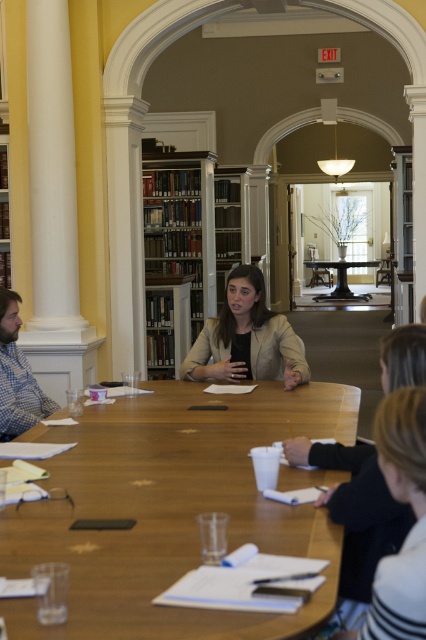
Question: Which object is positioned farthest from the beige textured blazer at center?

Choices:
 (A) black metal table at center
 (B) wooden table at center
 (C) wooden bookshelf at center
 (D) blue plaid shirt at left

Answer: (A)

Question: Is wooden bookshelf at center thinner than blue plaid shirt at left?

Choices:
 (A) no
 (B) yes

Answer: (A)

Question: Can you confirm if wooden bookshelf at center is positioned below black metal table at center?

Choices:
 (A) yes
 (B) no

Answer: (B)

Question: Is wooden bookshelf at center in front of beige textured blazer at center?

Choices:
 (A) no
 (B) yes

Answer: (A)

Question: Considering the real-world distances, which object is farthest from the black metal table at center?

Choices:
 (A) blue plaid shirt at left
 (B) wooden table at center
 (C) wooden bookshelf at center
 (D) beige textured blazer at center

Answer: (B)

Question: Which point is closer to the camera?

Choices:
 (A) (282, 362)
 (B) (5, 321)
 (C) (207, 204)
 (D) (339, 262)

Answer: (B)